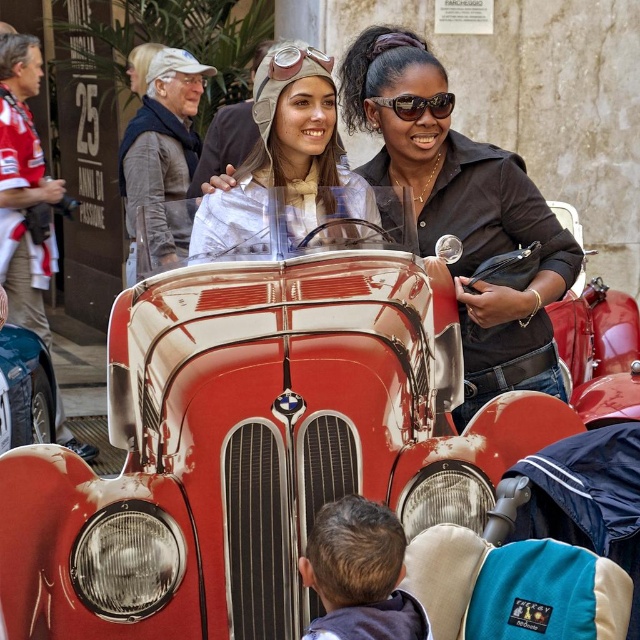
You are standing at the origin point of the coordinate system. The shiny red car at center is located at point (275, 440). Can you tell me the direction of the shiny red car at center relative to your position?

The shiny red car at center is located at point (275, 440), which is northeast of the origin point, so the direction is northeast.

You are a photographer at the classic car event and want to capture a closeup shot of both the metallic silver helmet at center and the shiny silver aviator goggles at upper center. Which object should you focus on first if you want to ensure both are in focus without moving the camera?

The metallic silver helmet at center is below the shiny silver aviator goggles at upper center, so focusing on the goggles first would allow both to be in focus as they are closer to the same plane.